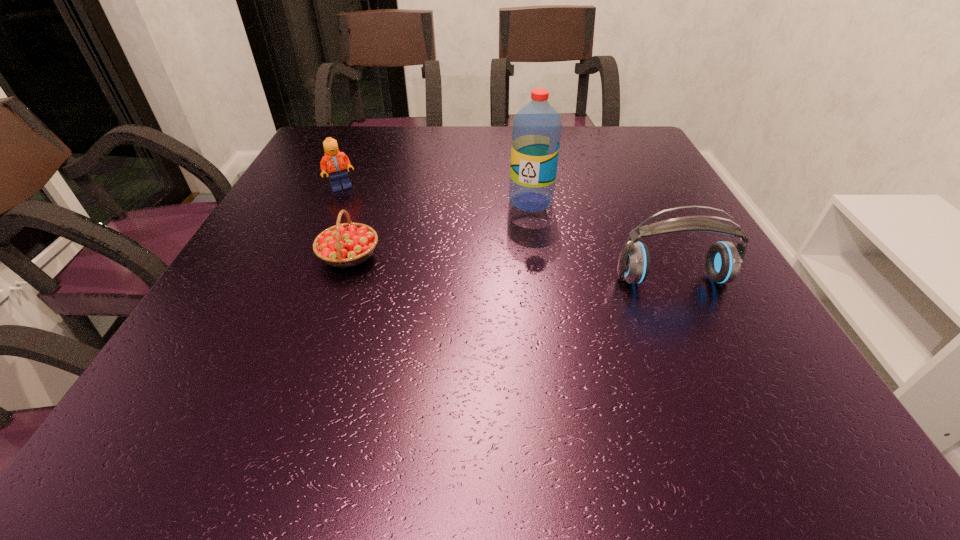
In the image, there is a desktop. At what (x,y) coordinates should I click in order to perform the action: click on vacant space at the right edge. Please return your answer as a coordinate pair (x, y). The height and width of the screenshot is (540, 960). Looking at the image, I should click on (666, 261).

In the image, there is a desktop. At what (x,y) coordinates should I click in order to perform the action: click on free space at the far right corner. Please return your answer as a coordinate pair (x, y). Looking at the image, I should click on (618, 158).

Find the location of `free point between the water bottle and the Lego`. free point between the water bottle and the Lego is located at coordinates (436, 194).

The width and height of the screenshot is (960, 540). Identify the location of vacant area that lies between the strawberry and the third tallest object. (345, 221).

At what (x,y) coordinates should I click in order to perform the action: click on free space between the third tallest object and the third shortest object. Please return your answer as a coordinate pair (x, y). The width and height of the screenshot is (960, 540). Looking at the image, I should click on (507, 233).

Find the location of `empty space between the second tallest object and the tallest object`. empty space between the second tallest object and the tallest object is located at coordinates (602, 240).

This screenshot has height=540, width=960. I want to click on vacant region between the second tallest object and the Lego, so click(x=507, y=233).

Locate an element on the screen. Image resolution: width=960 pixels, height=540 pixels. free spot between the water bottle and the third tallest object is located at coordinates (436, 194).

At what (x,y) coordinates should I click in order to perform the action: click on free space between the water bottle and the shortest object. Please return your answer as a coordinate pair (x, y). This screenshot has height=540, width=960. Looking at the image, I should click on (440, 228).

The height and width of the screenshot is (540, 960). Find the location of `blank region between the water bottle and the shortest object`. blank region between the water bottle and the shortest object is located at coordinates (440, 228).